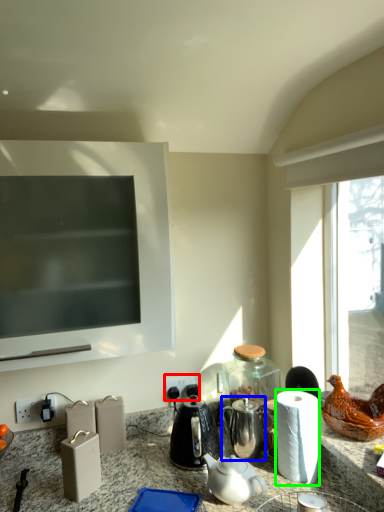
Question: Which object is positioned closest to electric outlet (highlighted by a red box)? Select from tea pot (highlighted by a blue box) and paper towel (highlighted by a green box).

Choices:
 (A) tea pot
 (B) paper towel

Answer: (A)